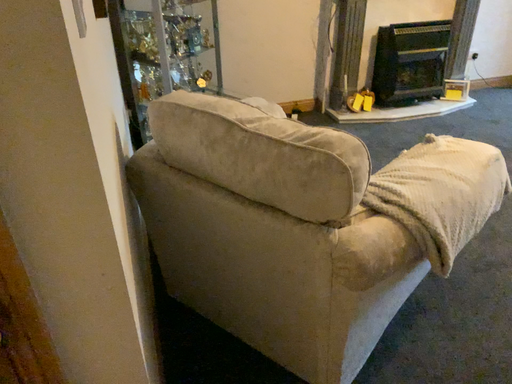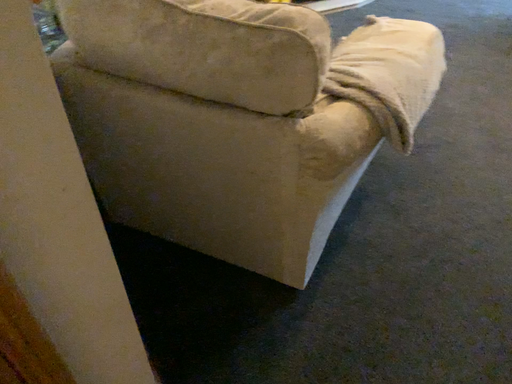
Question: How did the camera likely rotate when shooting the video?

Choices:
 (A) rotated left
 (B) rotated right

Answer: (B)